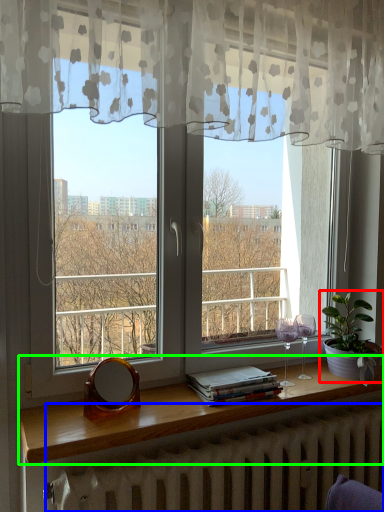
Question: Which is nearer to the houseplant (highlighted by a red box)? radiator (highlighted by a blue box) or window sill (highlighted by a green box).

Choices:
 (A) radiator
 (B) window sill

Answer: (B)